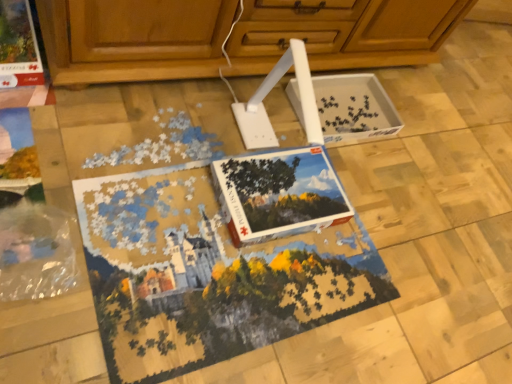
What do you see at coordinates (354, 109) in the screenshot?
I see `white cardboard box at center` at bounding box center [354, 109].

The width and height of the screenshot is (512, 384). What do you see at coordinates (133, 39) in the screenshot?
I see `wooden cabinet at upper center` at bounding box center [133, 39].

What is the approximate width of matte cardboard magazine at upper left, the 2th magazine ordered from the bottom?

matte cardboard magazine at upper left, the 2th magazine ordered from the bottom, is 44.33 centimeters wide.

I want to click on white cardboard puzzle box at center, the 2th magazine from the top, so click(x=279, y=194).

Is matte cardboard magazine at upper left, the 1th magazine from the left, located within white cardboard box at center?

Definitely not — matte cardboard magazine at upper left, the 1th magazine from the left, is not inside white cardboard box at center.

From the picture: Can you tell me how much white cardboard box at center and matte cardboard magazine at upper left, the 1th magazine from the left, differ in facing direction?

They differ by 0.0904 degrees in their facing directions.

Which is more to the right, white cardboard box at center or matte cardboard magazine at upper left, the 1th magazine from the left?

Positioned to the right is white cardboard box at center.

Consider the image. Is white cardboard box at center wider or thinner than matte cardboard magazine at upper left, which is the second magazine from right to left?

white cardboard box at center is thinner than matte cardboard magazine at upper left, which is the second magazine from right to left.

Would you say white cardboard puzzle box at center, which is the first magazine in bottom-to-top order, is inside or outside white cardboard box at center?

white cardboard puzzle box at center, which is the first magazine in bottom-to-top order, lies outside white cardboard box at center.

How different are the orientations of white cardboard puzzle box at center, which is the 2th magazine from left to right, and white cardboard box at center in degrees?

white cardboard puzzle box at center, which is the 2th magazine from left to right, and white cardboard box at center are facing 0.000268 degrees away from each other.

Does white cardboard puzzle box at center, the 1th magazine from the right, have a larger size compared to white cardboard box at center?

Actually, white cardboard puzzle box at center, the 1th magazine from the right, might be smaller than white cardboard box at center.

Is white cardboard puzzle box at center, which is the first magazine in bottom-to-top order, touching white cardboard box at center?

white cardboard puzzle box at center, which is the first magazine in bottom-to-top order, is not next to white cardboard box at center, and they're not touching.

Looking at this image, measure the distance from wooden cabinet at upper center to white cardboard box at center.

wooden cabinet at upper center is 9.97 inches from white cardboard box at center.

From the picture: Are wooden cabinet at upper center and white cardboard box at center located far from each other?

No.

Consider the image. How many degrees apart are the facing directions of wooden cabinet at upper center and white cardboard box at center?

wooden cabinet at upper center and white cardboard box at center are facing 1.36 degrees away from each other.

From a real-world perspective, is wooden cabinet at upper center above or below white cardboard box at center?

wooden cabinet at upper center is situated higher than white cardboard box at center in the real world.

Would you consider white cardboard box at center to be distant from wooden cabinet at upper center?

That's not correct — white cardboard box at center is a little close to wooden cabinet at upper center.

In order to click on cardboard box behind the wooden cabinet at upper center in this screenshot , I will do `click(354, 109)`.

Can you confirm if white cardboard box at center is bigger than wooden cabinet at upper center?

Actually, white cardboard box at center might be smaller than wooden cabinet at upper center.

Is point (352, 135) positioned after point (103, 82)?

Yes, it is.

What are the coordinates of `magazine located on the left of wooden cabinet at upper center` in the screenshot? It's located at (18, 46).

Is point (160, 55) less distant than point (18, 14)?

That is True.

Is the position of wooden cabinet at upper center more distant than that of matte cardboard magazine at upper left, which is the second magazine from right to left?

No, wooden cabinet at upper center is closer to the viewer.

Where is `magazine that is on the right side of wooden cabinet at upper center`? magazine that is on the right side of wooden cabinet at upper center is located at coordinates point(279,194).

Can you tell me how much wooden cabinet at upper center and white cardboard puzzle box at center, which is the 2th magazine from left to right, differ in facing direction?

They differ by 1.36 degrees in their facing directions.

In terms of size, does wooden cabinet at upper center appear bigger or smaller than white cardboard puzzle box at center, the 2th magazine from the top?

Clearly, wooden cabinet at upper center is larger in size than white cardboard puzzle box at center, the 2th magazine from the top.

From a real-world perspective, is wooden cabinet at upper center beneath white cardboard puzzle box at center, which is the first magazine in bottom-to-top order?

No, from a real-world perspective, wooden cabinet at upper center is not beneath white cardboard puzzle box at center, which is the first magazine in bottom-to-top order.

Which is more to the right, white cardboard box at center or white cardboard puzzle box at center, the 1th magazine from the right?

Positioned to the right is white cardboard box at center.

In the scene shown: What's the angular difference between white cardboard box at center and white cardboard puzzle box at center, which is the 2th magazine from left to right,'s facing directions?

They differ by 0.000268 degrees in their facing directions.

Between white cardboard box at center and white cardboard puzzle box at center, which is the 2th magazine from left to right, which one has smaller width?

white cardboard puzzle box at center, which is the 2th magazine from left to right.

Would you say white cardboard puzzle box at center, which is the 2th magazine from left to right, is part of white cardboard box at center's contents?

Result: No, white cardboard puzzle box at center, which is the 2th magazine from left to right, is not inside white cardboard box at center.

Where is `the 2nd magazine positioned above the white cardboard box at center (from a real-world perspective)`? the 2nd magazine positioned above the white cardboard box at center (from a real-world perspective) is located at coordinates (18, 46).

Where is `the 2nd magazine in front of the white cardboard box at center`? The width and height of the screenshot is (512, 384). the 2nd magazine in front of the white cardboard box at center is located at coordinates (279, 194).

Which object lies nearer to the anchor point white cardboard puzzle box at center, the 1th magazine from the right, wooden cabinet at upper center or white cardboard box at center?

white cardboard box at center is positioned closer to the anchor white cardboard puzzle box at center, the 1th magazine from the right.

Based on their spatial positions, is matte cardboard magazine at upper left, which appears as the 1th magazine when viewed from the top, or white cardboard puzzle box at center, which is the 2th magazine from left to right, further from wooden cabinet at upper center?

matte cardboard magazine at upper left, which appears as the 1th magazine when viewed from the top, lies further to wooden cabinet at upper center than the other object.

Based on their spatial positions, is matte cardboard magazine at upper left, the 2th magazine ordered from the bottom, or wooden cabinet at upper center further from white cardboard puzzle box at center, the 1th magazine from the right?

The object further to white cardboard puzzle box at center, the 1th magazine from the right, is matte cardboard magazine at upper left, the 2th magazine ordered from the bottom.

Looking at this image, when comparing their distances from white cardboard puzzle box at center, which is the 2th magazine from left to right, does wooden cabinet at upper center or matte cardboard magazine at upper left, which appears as the 1th magazine when viewed from the top, seem further?

matte cardboard magazine at upper left, which appears as the 1th magazine when viewed from the top, is positioned further to the anchor white cardboard puzzle box at center, which is the 2th magazine from left to right.

Looking at this image, estimate the real-world distances between objects in this image. Which object is further from white cardboard box at center, matte cardboard magazine at upper left, which appears as the 1th magazine when viewed from the top, or wooden cabinet at upper center?

matte cardboard magazine at upper left, which appears as the 1th magazine when viewed from the top.

From the image, which object appears to be farther from wooden cabinet at upper center, white cardboard puzzle box at center, which is the 2th magazine from left to right, or white cardboard box at center?

white cardboard puzzle box at center, which is the 2th magazine from left to right, is positioned further to the anchor wooden cabinet at upper center.

Considering their positions, is white cardboard puzzle box at center, the 2th magazine from the top, positioned further to wooden cabinet at upper center than matte cardboard magazine at upper left, which appears as the 1th magazine when viewed from the top?

The object further to wooden cabinet at upper center is matte cardboard magazine at upper left, which appears as the 1th magazine when viewed from the top.

Based on their spatial positions, is white cardboard puzzle box at center, which is the 2th magazine from left to right, or white cardboard box at center further from matte cardboard magazine at upper left, which appears as the 1th magazine when viewed from the top?

white cardboard box at center lies further to matte cardboard magazine at upper left, which appears as the 1th magazine when viewed from the top, than the other object.

Where is `cabinetry between matte cardboard magazine at upper left, which appears as the 1th magazine when viewed from the top, and white cardboard puzzle box at center, which is the first magazine in bottom-to-top order`? cabinetry between matte cardboard magazine at upper left, which appears as the 1th magazine when viewed from the top, and white cardboard puzzle box at center, which is the first magazine in bottom-to-top order is located at coordinates (133, 39).

You are a GUI agent. You are given a task and a screenshot of the screen. Output one action in this format:
    pyautogui.click(x=<x>, y=<y>)
    Task: Click on the cabinetry located between matte cardboard magazine at upper left, the 1th magazine from the left, and white cardboard box at center in the left-right direction
    The height and width of the screenshot is (384, 512).
    Given the screenshot: What is the action you would take?
    pyautogui.click(x=133, y=39)

Find the location of a particular element. The image size is (512, 384). magazine between matte cardboard magazine at upper left, which is the second magazine from right to left, and white cardboard box at center from left to right is located at coordinates coord(279,194).

Where is `cardboard box between wooden cabinet at upper center and white cardboard puzzle box at center, which is the 2th magazine from left to right, in the up-down direction`? The width and height of the screenshot is (512, 384). cardboard box between wooden cabinet at upper center and white cardboard puzzle box at center, which is the 2th magazine from left to right, in the up-down direction is located at coordinates (354, 109).